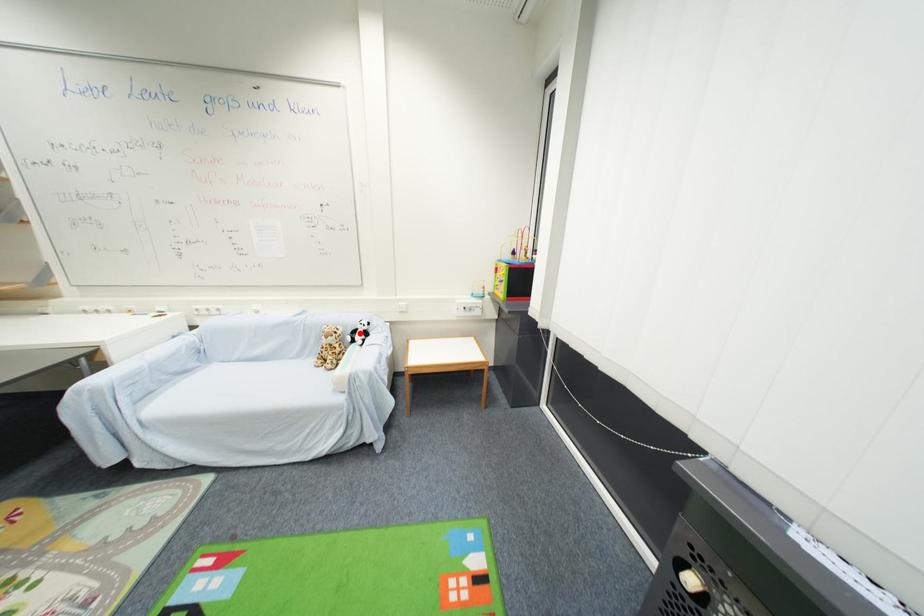
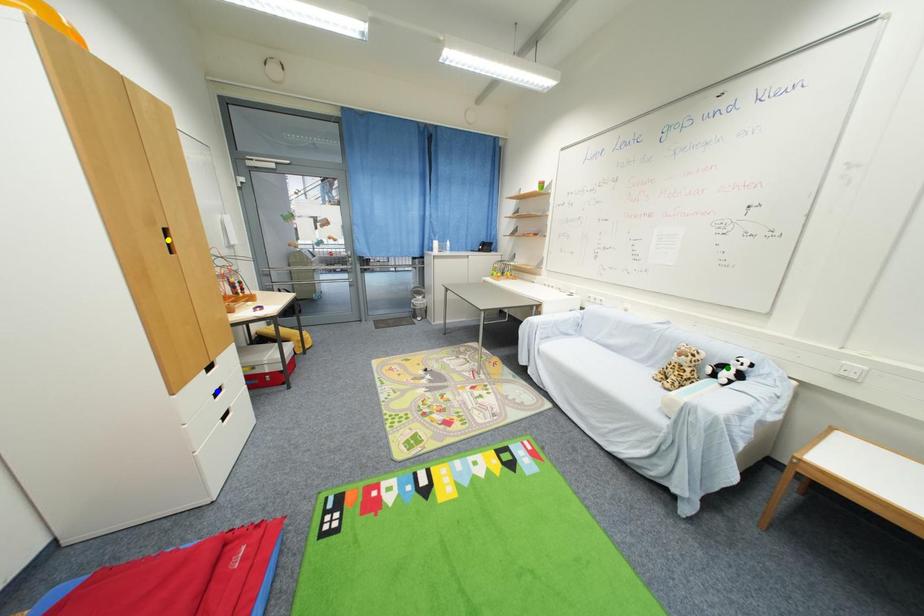
Question: I am providing you with two images of the same scene from different viewpoints. A red point is marked on the first image. You are given multiple points on the second image. Which point in image 2 is actually the same real-world point as the red point in image 1?

Choices:
 (A) blue point
 (B) yellow point
 (C) green point

Answer: (C)